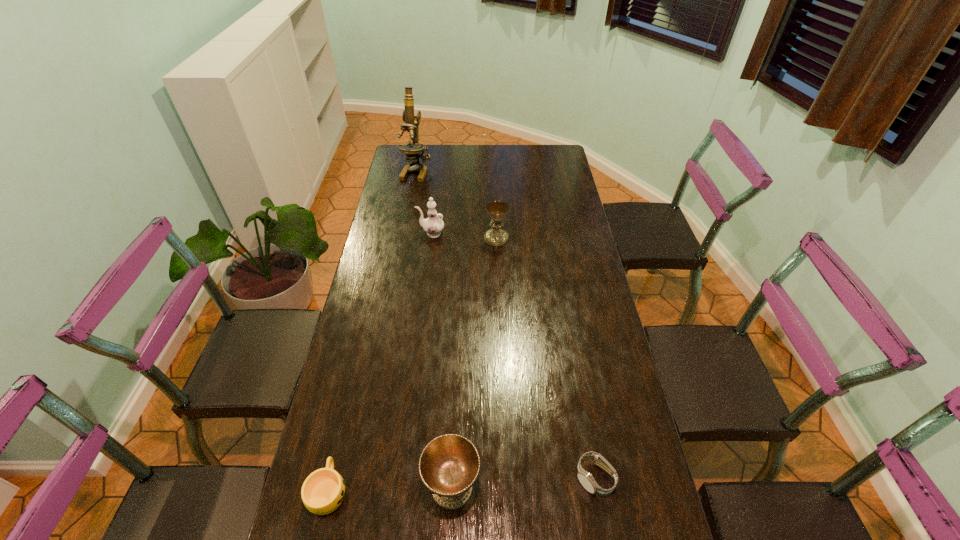
The image size is (960, 540). I want to click on the tallest object, so click(412, 150).

You are a GUI agent. You are given a task and a screenshot of the screen. Output one action in this format:
    pyautogui.click(x=<x>, y=<y>)
    Task: Click on the farthest object
    Image resolution: width=960 pixels, height=540 pixels.
    Given the screenshot: What is the action you would take?
    pyautogui.click(x=412, y=150)

I want to click on chinaware, so click(433, 225).

Where is `the farther chalice`? the farther chalice is located at coordinates (497, 210).

Where is `the right chalice`? the right chalice is located at coordinates (497, 210).

Find the location of a particular element. This screenshot has width=960, height=540. the nearer chalice is located at coordinates (449, 465).

In order to click on the third object from right to left in this screenshot , I will do `click(449, 465)`.

Image resolution: width=960 pixels, height=540 pixels. Identify the location of the rightmost object. (586, 479).

Where is `cup`? Image resolution: width=960 pixels, height=540 pixels. cup is located at coordinates (323, 491).

Identify the location of free space located 0.220m on the front of the tallest object. The width and height of the screenshot is (960, 540). (409, 212).